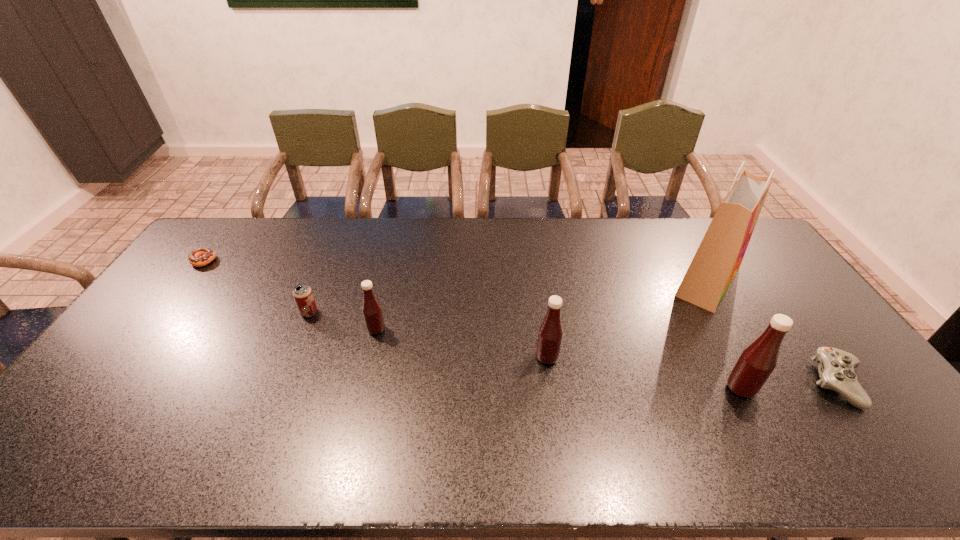
Locate an element on the screen. The height and width of the screenshot is (540, 960). vacant region at the left edge is located at coordinates (180, 318).

Find the location of a particular element. The image size is (960, 540). blank space at the right edge of the desktop is located at coordinates pos(765,311).

Where is `free space between the second Tabasco sauce from right to left and the third shortest object`? Image resolution: width=960 pixels, height=540 pixels. free space between the second Tabasco sauce from right to left and the third shortest object is located at coordinates (428, 335).

Where is `empty location between the tallest object and the second Tabasco sauce from left to right`? The width and height of the screenshot is (960, 540). empty location between the tallest object and the second Tabasco sauce from left to right is located at coordinates (628, 319).

The image size is (960, 540). In order to click on free area in between the second tallest Tabasco sauce and the shopping bag in this screenshot , I will do `click(628, 319)`.

Find the location of `free area in between the leftmost Tabasco sauce and the fifth tallest object`. free area in between the leftmost Tabasco sauce and the fifth tallest object is located at coordinates (343, 321).

Where is `vacant region between the sixth tallest object and the second Tabasco sauce from right to left`? vacant region between the sixth tallest object and the second Tabasco sauce from right to left is located at coordinates point(693,370).

Identify the location of free space between the fifth tallest object and the doughnut. This screenshot has width=960, height=540. (256, 287).

Find the location of a particular element. vacant area that lies between the fifth object from right to left and the shopping bag is located at coordinates (542, 306).

Image resolution: width=960 pixels, height=540 pixels. Find the location of `vacant area that lies between the sixth object from right to left and the second shortest Tabasco sauce`. vacant area that lies between the sixth object from right to left and the second shortest Tabasco sauce is located at coordinates (428, 335).